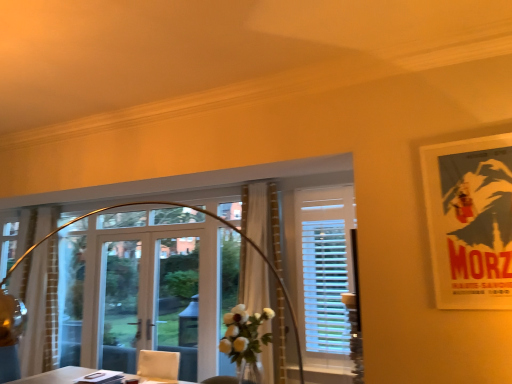
Question: Can you confirm if matte paper poster at upper right is positioned to the right of clear glass door at center?

Choices:
 (A) yes
 (B) no

Answer: (A)

Question: From a real-world perspective, is matte paper poster at upper right physically above clear glass door at center?

Choices:
 (A) yes
 (B) no

Answer: (A)

Question: Is clear glass door at center located within matte paper poster at upper right?

Choices:
 (A) yes
 (B) no

Answer: (B)

Question: From a real-world perspective, is matte paper poster at upper right located beneath clear glass door at center?

Choices:
 (A) no
 (B) yes

Answer: (A)

Question: Does matte paper poster at upper right have a greater height compared to clear glass door at center?

Choices:
 (A) yes
 (B) no

Answer: (B)

Question: Is matte paper poster at upper right facing towards clear glass door at center?

Choices:
 (A) yes
 (B) no

Answer: (B)

Question: From a real-world perspective, is matte paper poster at upper right on white sheer curtain at left, positioned as the 1th curtain in back-to-front order?

Choices:
 (A) yes
 (B) no

Answer: (A)

Question: Is matte paper poster at upper right located outside white sheer curtain at left, the second curtain positioned from the right?

Choices:
 (A) no
 (B) yes

Answer: (B)

Question: Does matte paper poster at upper right have a smaller size compared to white sheer curtain at left, positioned as the 1th curtain in back-to-front order?

Choices:
 (A) no
 (B) yes

Answer: (B)

Question: Considering the relative positions of matte paper poster at upper right and white sheer curtain at left, positioned as the 1th curtain in back-to-front order, in the image provided, is matte paper poster at upper right to the right of white sheer curtain at left, positioned as the 1th curtain in back-to-front order, from the viewer's perspective?

Choices:
 (A) no
 (B) yes

Answer: (B)

Question: Does matte paper poster at upper right lie behind white sheer curtain at left, the 1th curtain positioned from the left?

Choices:
 (A) yes
 (B) no

Answer: (B)

Question: Does matte paper poster at upper right have a lesser width compared to white sheer curtain at left, the 1th curtain positioned from the left?

Choices:
 (A) yes
 (B) no

Answer: (A)

Question: Considering the relative sizes of transparent glass window at center, which is counted as the first window, starting from the left, and white sheer curtain at left, positioned as the 1th curtain in back-to-front order, in the image provided, is transparent glass window at center, which is counted as the first window, starting from the left, shorter than white sheer curtain at left, positioned as the 1th curtain in back-to-front order,?

Choices:
 (A) yes
 (B) no

Answer: (A)